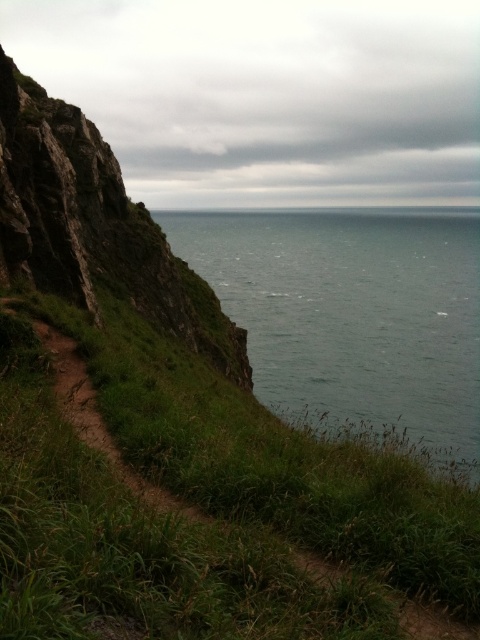
Who is lower down, green grassy at lower left or greenish-blue water at center?

green grassy at lower left is below.

Who is more forward, (159,612) or (305,298)?

Positioned in front is point (159,612).

Locate an element on the screen. This screenshot has width=480, height=640. green grassy at lower left is located at coordinates (204, 502).

Which is above, greenish-blue water at center or rough stone cliff at left?

greenish-blue water at center is higher up.

Is greenish-blue water at center further to camera compared to rough stone cliff at left?

That is False.

At what (x,y) coordinates should I click in order to perform the action: click on greenish-blue water at center. Please return your answer as a coordinate pair (x, y). The width and height of the screenshot is (480, 640). Looking at the image, I should click on (352, 316).

Does green grassy at lower left have a lesser height compared to rough stone cliff at left?

Correct, green grassy at lower left is not as tall as rough stone cliff at left.

Locate an element on the screen. green grassy at lower left is located at coordinates (204, 502).